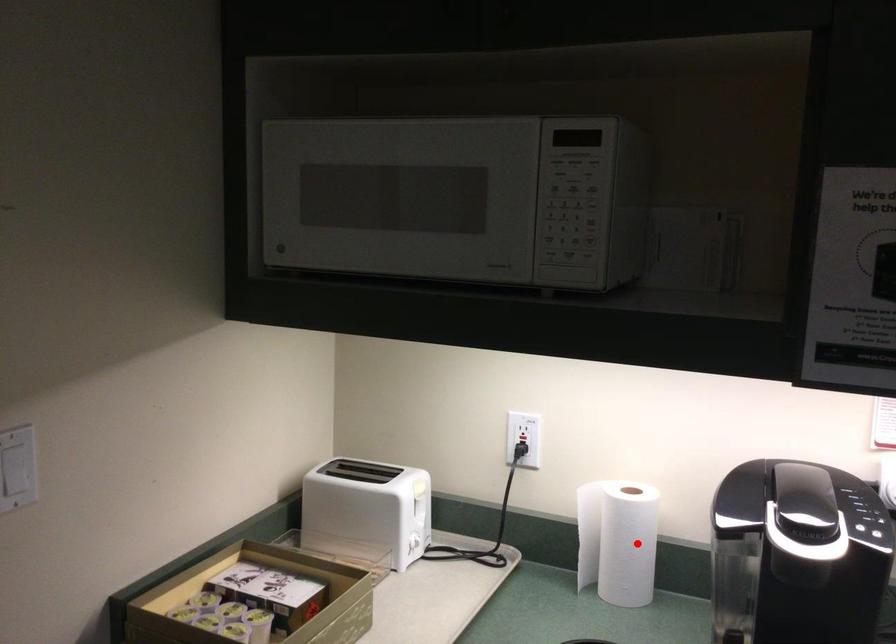
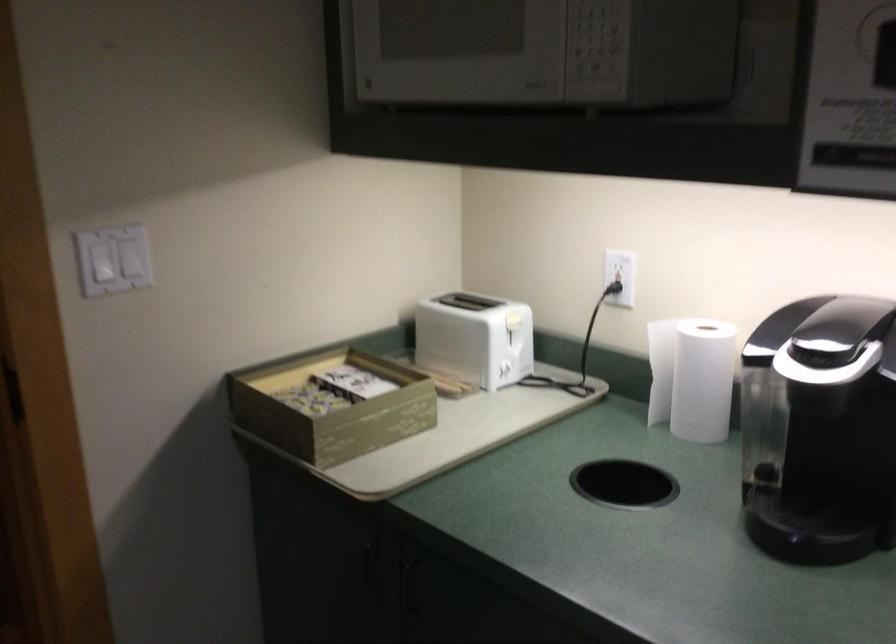
Locate, in the second image, the point that corresponds to the highlighted location in the first image.

(702, 380)